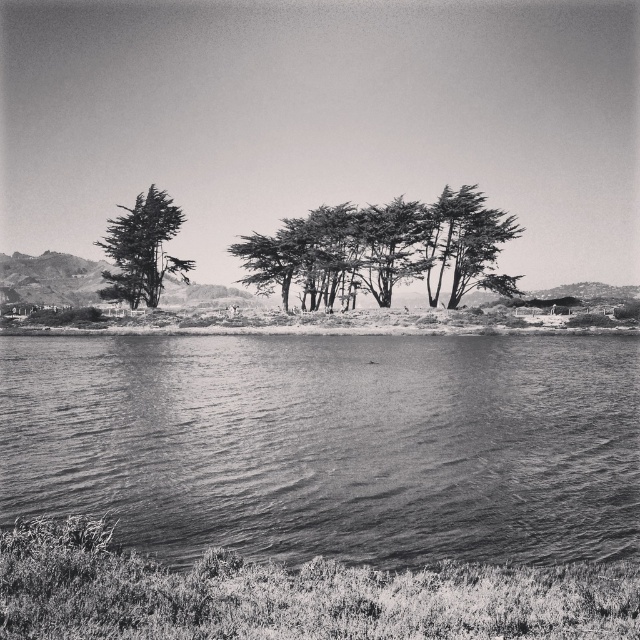
Who is positioned more to the left, smooth bark trees at center or smooth bark tree at left?

Positioned to the left is smooth bark tree at left.

Looking at this image, can you confirm if smooth bark trees at center is shorter than smooth bark tree at left?

Yes, smooth bark trees at center is shorter than smooth bark tree at left.

Is point (486, 250) closer to camera compared to point (163, 212)?

Yes, it is.

This screenshot has width=640, height=640. I want to click on smooth bark trees at center, so click(384, 248).

Does smooth water at lower center appear under smooth bark tree at left?

Yes, smooth water at lower center is below smooth bark tree at left.

From the picture: Which is more to the left, smooth water at lower center or smooth bark tree at left?

Positioned to the left is smooth bark tree at left.

Which is behind, point (573, 429) or point (136, 252)?

Point (136, 252)

This screenshot has width=640, height=640. Find the location of `smooth water at lower center`. smooth water at lower center is located at coordinates (330, 444).

Is smooth water at lower center to the right of smooth bark trees at center from the viewer's perspective?

Correct, you'll find smooth water at lower center to the right of smooth bark trees at center.

At what (x,y) coordinates should I click in order to perform the action: click on smooth water at lower center. Please return your answer as a coordinate pair (x, y). Image resolution: width=640 pixels, height=640 pixels. Looking at the image, I should click on (330, 444).